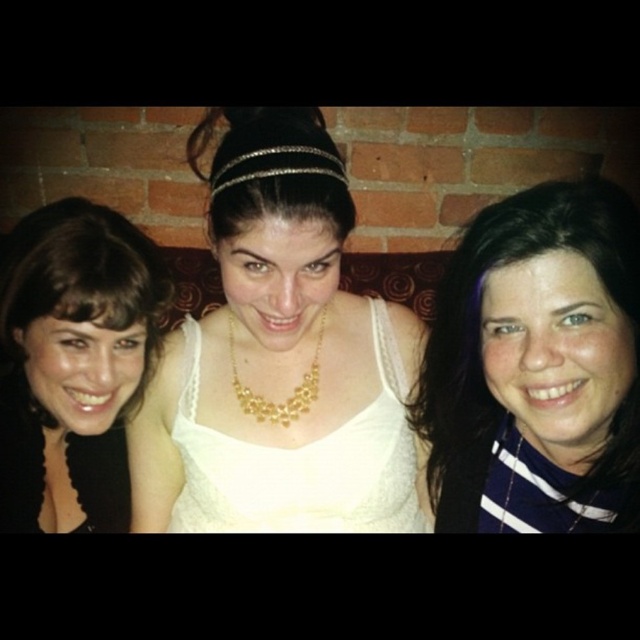
Is white lace dress at center to the left of dark blue striped shirt at right from the viewer's perspective?

Indeed, white lace dress at center is positioned on the left side of dark blue striped shirt at right.

Between white lace dress at center and dark blue striped shirt at right, which one appears on the right side from the viewer's perspective?

Positioned to the right is dark blue striped shirt at right.

Where is `white lace dress at center`? This screenshot has width=640, height=640. white lace dress at center is located at coordinates (280, 358).

Is white lace dress at center thinner than gold metallic necklace at center?

No.

Based on the photo, which of these two, white lace dress at center or gold metallic necklace at center, stands taller?

white lace dress at center

Is point (241, 124) less distant than point (291, 403)?

Yes, point (241, 124) is closer to viewer.

Locate an element on the screen. white lace dress at center is located at coordinates (280, 358).

Which is more to the right, dark blue striped shirt at right or gold metallic necklace at center?

Positioned to the right is dark blue striped shirt at right.

In the scene shown: Is dark blue striped shirt at right thinner than gold metallic necklace at center?

No.

Where is `dark blue striped shirt at right`? Image resolution: width=640 pixels, height=640 pixels. dark blue striped shirt at right is located at coordinates (538, 365).